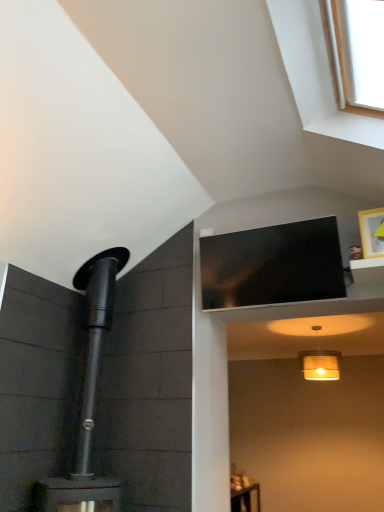
Question: Is matte white lampshade at lower center inside or outside of wooden picture frame at upper right?

Choices:
 (A) inside
 (B) outside

Answer: (B)

Question: Based on their sizes in the image, would you say matte white lampshade at lower center is bigger or smaller than wooden picture frame at upper right?

Choices:
 (A) big
 (B) small

Answer: (A)

Question: Which of these objects is positioned farthest from the wooden picture frame at upper right?

Choices:
 (A) white wood window at upper right
 (B) black glossy tv at upper center
 (C) matte white lampshade at lower center

Answer: (C)

Question: Considering the real-world distances, which object is farthest from the white wood window at upper right?

Choices:
 (A) black glossy tv at upper center
 (B) wooden picture frame at upper right
 (C) matte white lampshade at lower center

Answer: (C)